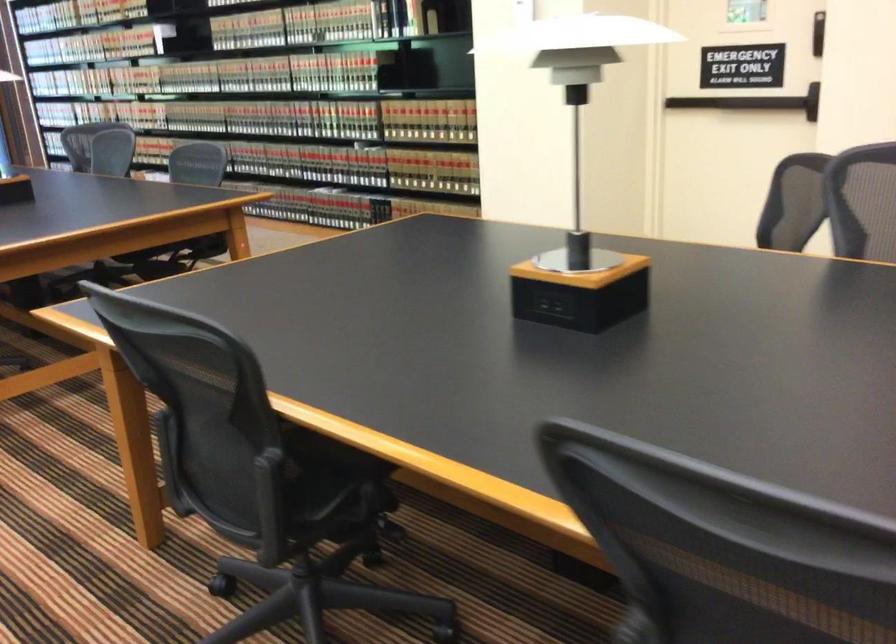
The width and height of the screenshot is (896, 644). In order to click on black door handle in this screenshot , I will do `click(752, 102)`.